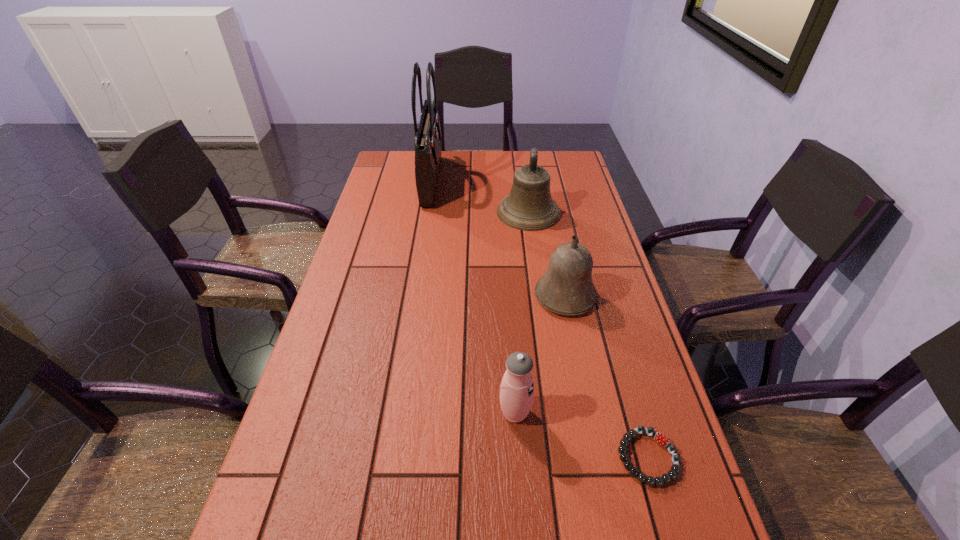
Find the location of `vacant area that lies between the handbag and the nearest object`. vacant area that lies between the handbag and the nearest object is located at coordinates 540,319.

Where is `vacant space in between the farther bell and the thermos bottle`? This screenshot has height=540, width=960. vacant space in between the farther bell and the thermos bottle is located at coordinates (521, 313).

At what (x,y) coordinates should I click in order to perform the action: click on free space between the nearer bell and the handbag. Please return your answer as a coordinate pair (x, y). The width and height of the screenshot is (960, 540). Looking at the image, I should click on (498, 238).

Identify the location of free space between the shortest object and the third farthest object. Image resolution: width=960 pixels, height=540 pixels. (607, 377).

The height and width of the screenshot is (540, 960). In order to click on vacant area that lies between the nearest object and the tallest object in this screenshot , I will do `click(540, 319)`.

This screenshot has height=540, width=960. I want to click on vacant area that lies between the leftmost object and the shorter bell, so click(498, 238).

The height and width of the screenshot is (540, 960). What are the coordinates of `free spot between the farther bell and the second nearest object` in the screenshot? It's located at (521, 313).

This screenshot has width=960, height=540. What are the coordinates of `free space between the second nearest object and the shorter bell` in the screenshot? It's located at (540, 355).

Point out which object is positioned as the third nearest to the nearest object. Please provide its 2D coordinates. Your answer should be formatted as a tuple, i.e. [(x, y)], where the tuple contains the x and y coordinates of a point satisfying the conditions above.

[(529, 206)]

Locate which object ranks in proximity to the thermos bottle. Please provide its 2D coordinates. Your answer should be formatted as a tuple, i.e. [(x, y)], where the tuple contains the x and y coordinates of a point satisfying the conditions above.

[(660, 438)]